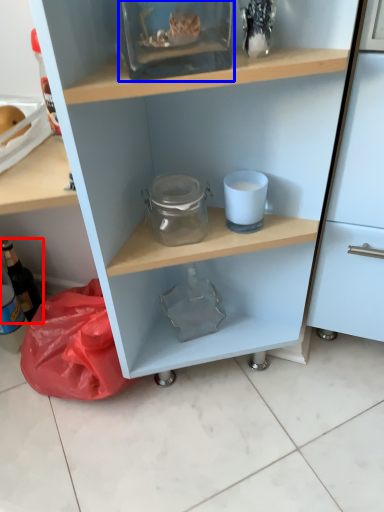
Question: Which object appears closest to the camera in this image, bottle (highlighted by a red box) or glass box (highlighted by a blue box)?

Choices:
 (A) bottle
 (B) glass box

Answer: (B)